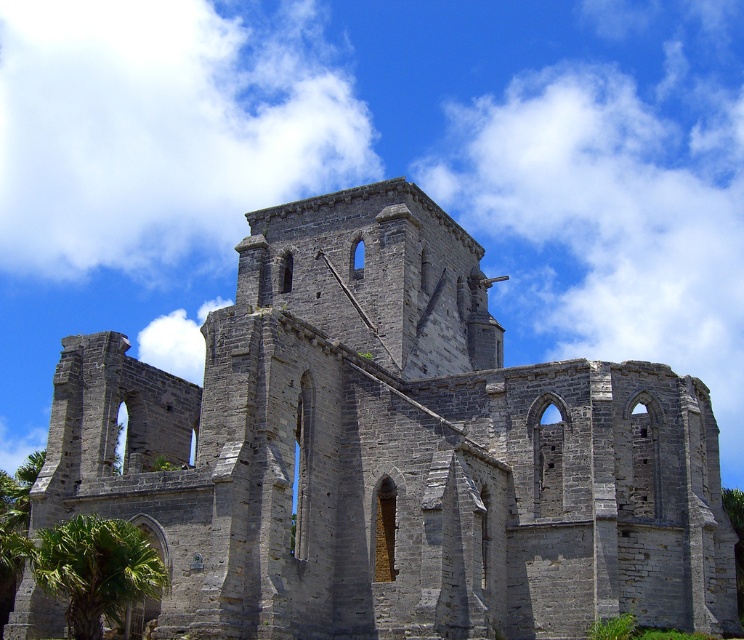
Question: Is gray stone ruins at center to the right of green leafy palm tree at lower left from the viewer's perspective?

Choices:
 (A) yes
 (B) no

Answer: (A)

Question: Observing the image, what is the correct spatial positioning of gray stone ruins at center in reference to green leafy palm tree at lower left?

Choices:
 (A) below
 (B) above

Answer: (B)

Question: Which point is farther to the camera?

Choices:
 (A) (94, 532)
 (B) (350, 390)

Answer: (B)

Question: Can you confirm if gray stone ruins at center is positioned above green leafy palm tree at lower left?

Choices:
 (A) no
 (B) yes

Answer: (B)

Question: Among these points, which one is farthest from the camera?

Choices:
 (A) click(x=103, y=573)
 (B) click(x=365, y=627)

Answer: (B)